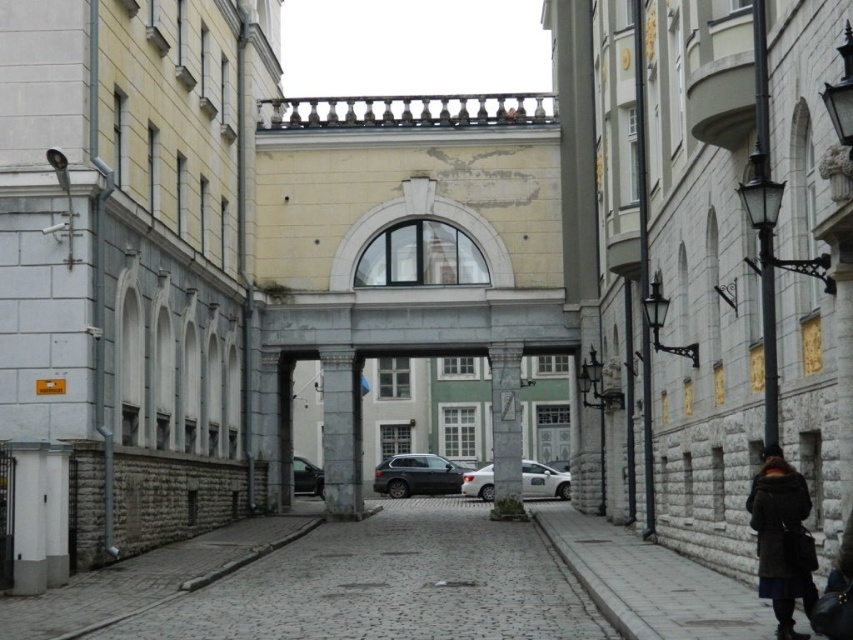
Question: Which point is closer to the camera?

Choices:
 (A) (276, 637)
 (B) (427, 484)
 (C) (316, 468)
 (D) (554, 492)

Answer: (A)

Question: Can you confirm if gray cobblestone pavement at center is bigger than white metallic car at center?

Choices:
 (A) yes
 (B) no

Answer: (A)

Question: Which point is closer to the camera taking this photo?

Choices:
 (A) (355, 602)
 (B) (396, 460)

Answer: (A)

Question: Can you confirm if gray cobblestone pavement at center is positioned below matte black suv at center?

Choices:
 (A) no
 (B) yes

Answer: (A)

Question: Does white metallic car at center come in front of shiny black car at center?

Choices:
 (A) yes
 (B) no

Answer: (B)

Question: Among these objects, which one is nearest to the camera?

Choices:
 (A) dark brown wool coat at lower right
 (B) white metallic car at center
 (C) gray cobblestone pavement at center

Answer: (A)